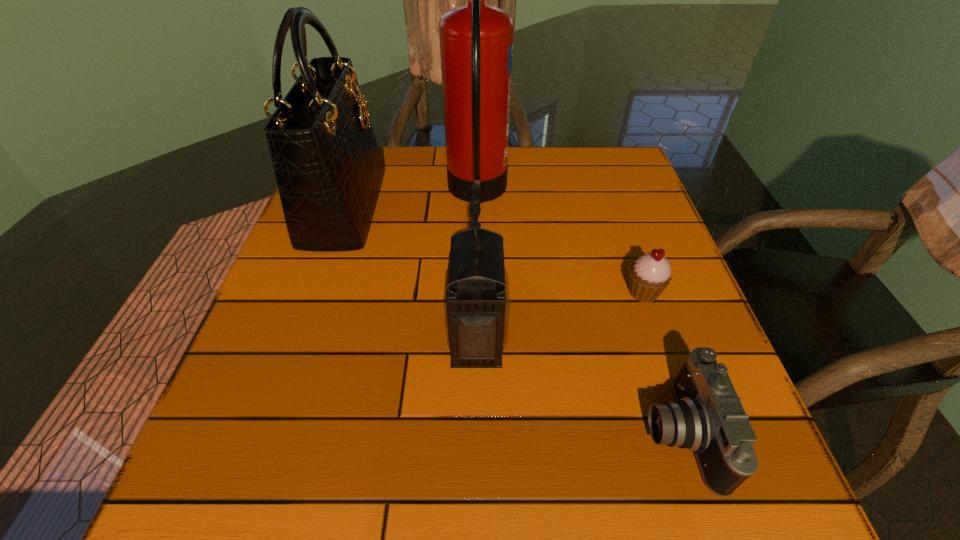
What are the coordinates of `fire extinguisher` in the screenshot? It's located at (476, 40).

The width and height of the screenshot is (960, 540). I want to click on the second tallest object, so click(328, 167).

You are a GUI agent. You are given a task and a screenshot of the screen. Output one action in this format:
    pyautogui.click(x=<x>, y=<y>)
    Task: Click on the leftmost object
    
    Given the screenshot: What is the action you would take?
    pyautogui.click(x=328, y=167)

Where is `the third shortest object`? The height and width of the screenshot is (540, 960). the third shortest object is located at coordinates (476, 300).

The height and width of the screenshot is (540, 960). What are the coordinates of `lantern` in the screenshot? It's located at (476, 300).

This screenshot has width=960, height=540. I want to click on the nearest object, so [x=707, y=417].

Locate an element on the screen. cupcake is located at coordinates (650, 274).

Identify the location of blank area located on the surface of the fire extinguisher. (629, 193).

Find the location of a particular element. This screenshot has height=540, width=960. vacant region located at the front of the leftmost object with visible charms is located at coordinates (494, 208).

Identify the location of vacant space located on the front-facing side of the fourth farthest object. This screenshot has height=540, width=960. (708, 340).